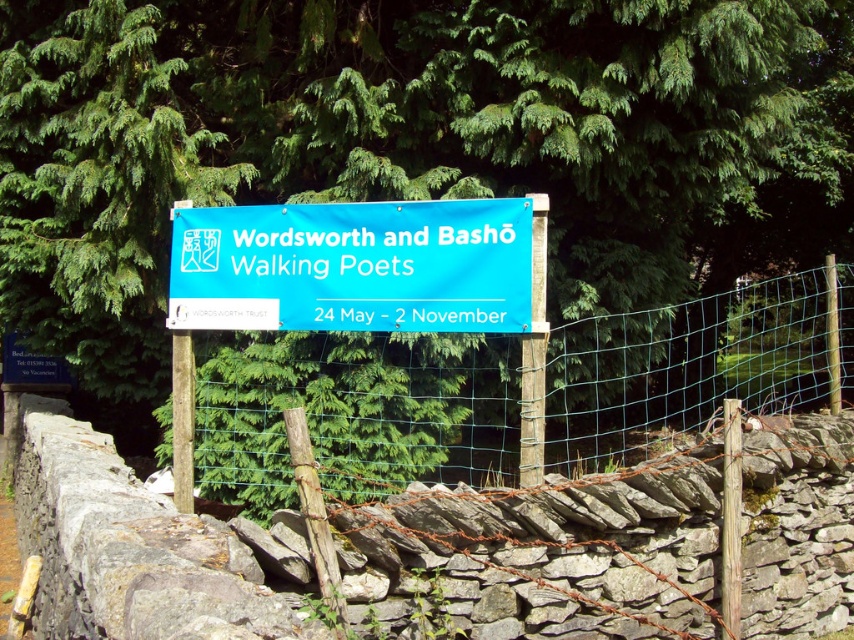
Question: Is the position of green leafy tree at upper center less distant than that of green wire mesh at center?

Choices:
 (A) no
 (B) yes

Answer: (A)

Question: Observing the image, what is the correct spatial positioning of green wire mesh at center in reference to blue fabric banner at center?

Choices:
 (A) below
 (B) above

Answer: (A)

Question: Estimate the real-world distances between objects in this image. Which object is farther from the blue fabric banner at center?

Choices:
 (A) green wire mesh at center
 (B) wooden post at center

Answer: (A)

Question: Among these points, which one is nearest to the camera?

Choices:
 (A) (188, 410)
 (B) (410, 179)
 (C) (699, 381)

Answer: (A)

Question: Considering the real-world distances, which object is farthest from the brown wooden post at center?

Choices:
 (A) green leafy tree at upper center
 (B) green wire mesh at center
 (C) blue fabric banner at center

Answer: (B)

Question: Is green wire mesh at center to the right of wooden post at center from the viewer's perspective?

Choices:
 (A) no
 (B) yes

Answer: (B)